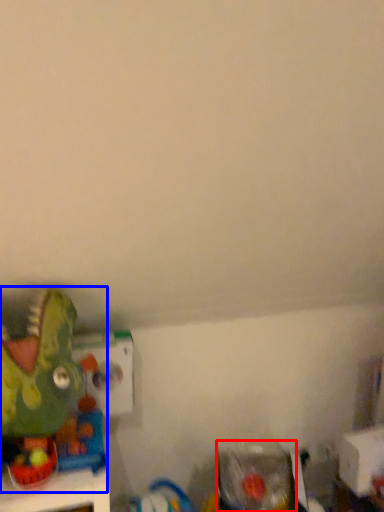
Question: Among these objects, which one is farthest to the camera, toy (highlighted by a red box) or toy (highlighted by a blue box)?

Choices:
 (A) toy
 (B) toy

Answer: (A)